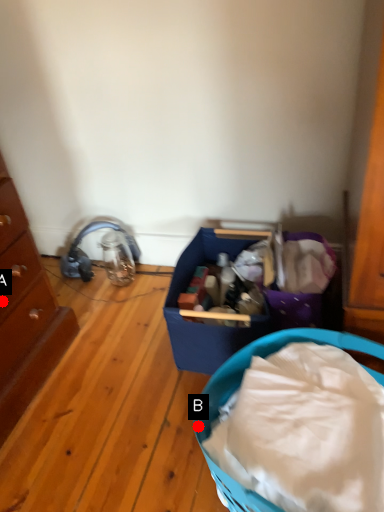
Question: Two points are circled on the image, labeled by A and B beside each circle. Which point is further to the camera?

Choices:
 (A) A is further
 (B) B is further

Answer: (A)